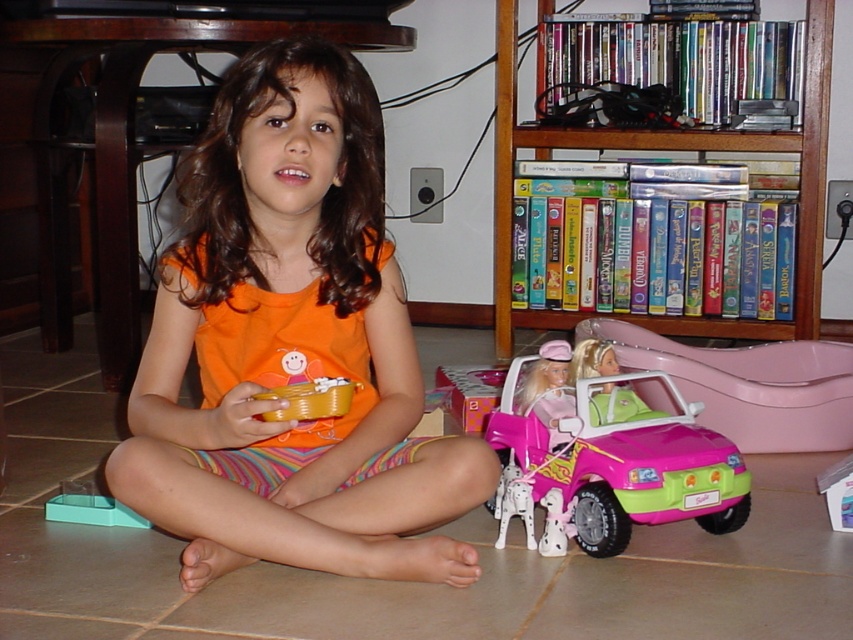
What are the coordinates of the wooden bookshelf at upper right?

The wooden bookshelf at upper right is located at point (668, 148).

You are a toy organizer trying to arrange the pink matte toy car at lower center and the pink plastic car at lower right on a shelf. Which car should you place first if you want to arrange them from closest to farthest from the viewer?

You should place the pink matte toy car at lower center first because it is closer to the viewer than the pink plastic car at lower right.